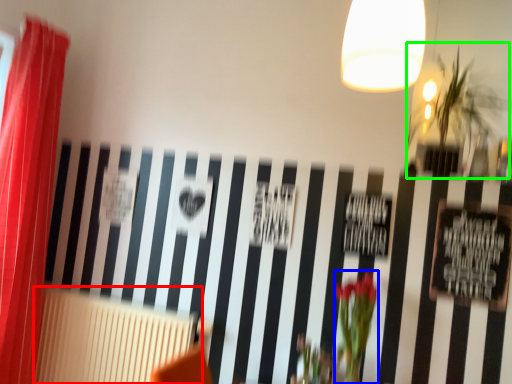
Question: Considering the real-world distances, which object is closest to radiator (highlighted by a red box)? floral arrangement (highlighted by a blue box) or plant (highlighted by a green box).

Choices:
 (A) floral arrangement
 (B) plant

Answer: (A)